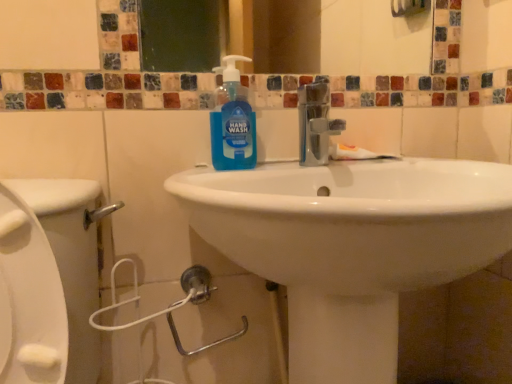
Question: From a real-world perspective, is white matte toothpaste at center over white glossy sink at center?

Choices:
 (A) no
 (B) yes

Answer: (B)

Question: Is white matte toothpaste at center at the left side of white glossy sink at center?

Choices:
 (A) yes
 (B) no

Answer: (B)

Question: From the image's perspective, is white matte toothpaste at center located above white glossy sink at center?

Choices:
 (A) yes
 (B) no

Answer: (A)

Question: Does white matte toothpaste at center have a greater width compared to white glossy sink at center?

Choices:
 (A) yes
 (B) no

Answer: (B)

Question: Can you confirm if white matte toothpaste at center is shorter than white glossy sink at center?

Choices:
 (A) no
 (B) yes

Answer: (B)

Question: Does white matte toothpaste at center come in front of white glossy sink at center?

Choices:
 (A) no
 (B) yes

Answer: (A)

Question: Is white glossy sink at center to the left of white matte toothpaste at center from the viewer's perspective?

Choices:
 (A) yes
 (B) no

Answer: (A)

Question: Is white glossy sink at center positioned before white matte toothpaste at center?

Choices:
 (A) no
 (B) yes

Answer: (B)

Question: Can you confirm if white glossy sink at center is thinner than white matte toothpaste at center?

Choices:
 (A) yes
 (B) no

Answer: (B)

Question: Is white glossy sink at center aimed at white matte toothpaste at center?

Choices:
 (A) no
 (B) yes

Answer: (A)

Question: Is white glossy sink at center turned away from white matte toothpaste at center?

Choices:
 (A) yes
 (B) no

Answer: (A)

Question: From the image's perspective, is white glossy sink at center on top of white matte toothpaste at center?

Choices:
 (A) yes
 (B) no

Answer: (B)

Question: From a real-world perspective, is blue translucent hand wash at center positioned over white matte toothpaste at center based on gravity?

Choices:
 (A) no
 (B) yes

Answer: (B)